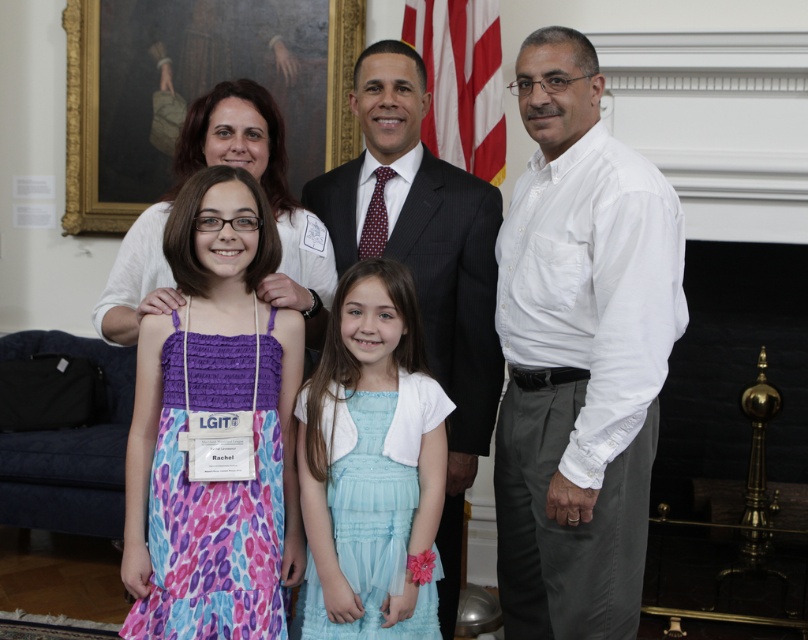
In the photograph, there are two white shirts visible. The first is the white cotton shirt at right, and the second is the white fabric shirt at upper left. Which of these two shirts is bigger in size?

The white cotton shirt at right is larger in size compared to the white fabric shirt at upper left.

You are a photographer arranging a group photo. You have two white shirts in the scene, the white cotton shirt at right and the white fabric shirt at upper left. Which shirt is narrower in width?

The white cotton shirt at right is narrower in width than the white fabric shirt at upper left.